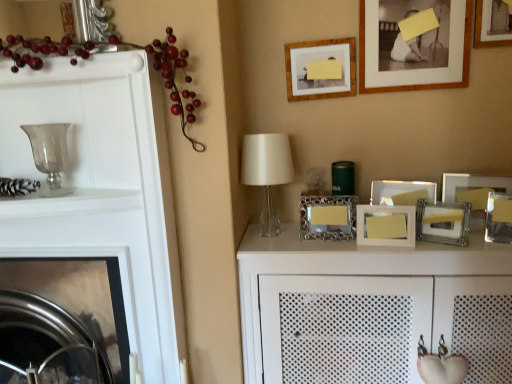
You are a GUI agent. You are given a task and a screenshot of the screen. Output one action in this format:
    pyautogui.click(x=<x>, y=<y>)
    Task: Click on the free spot in front of metallic silver picture frame at right, which is the 5th picture frame from bottom to top
    The height and width of the screenshot is (384, 512).
    Given the screenshot: What is the action you would take?
    point(484,242)